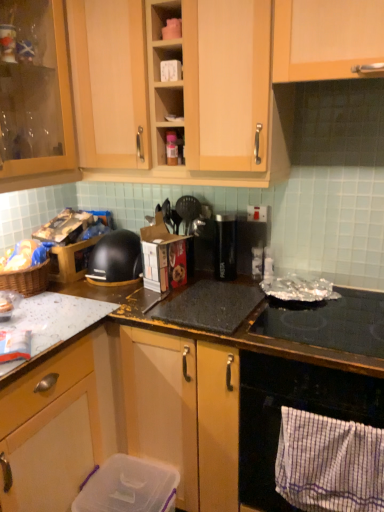
Find the location of a particular element. The image size is (384, 512). empty space that is ontop of white striped towel at lower right (from a real-world perspective) is located at coordinates (329, 411).